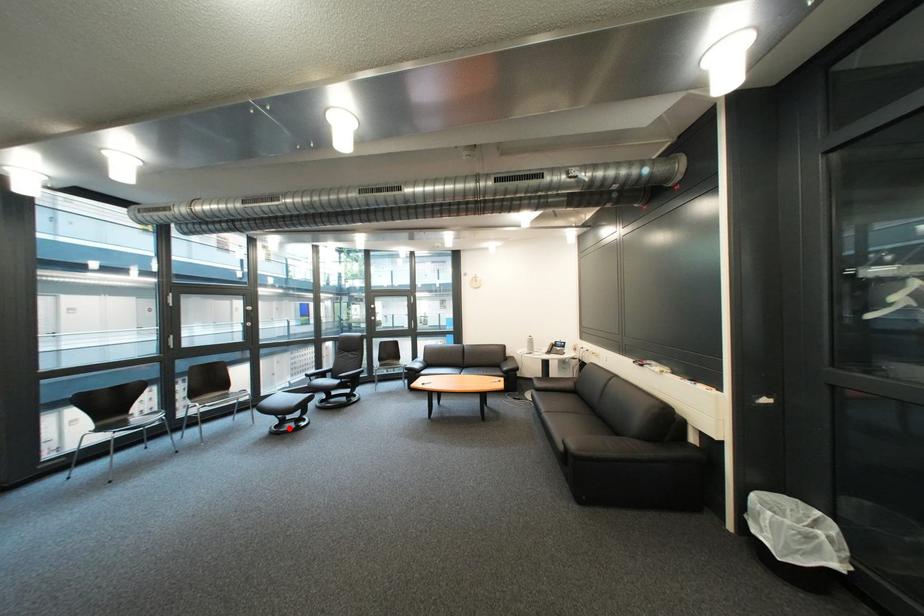
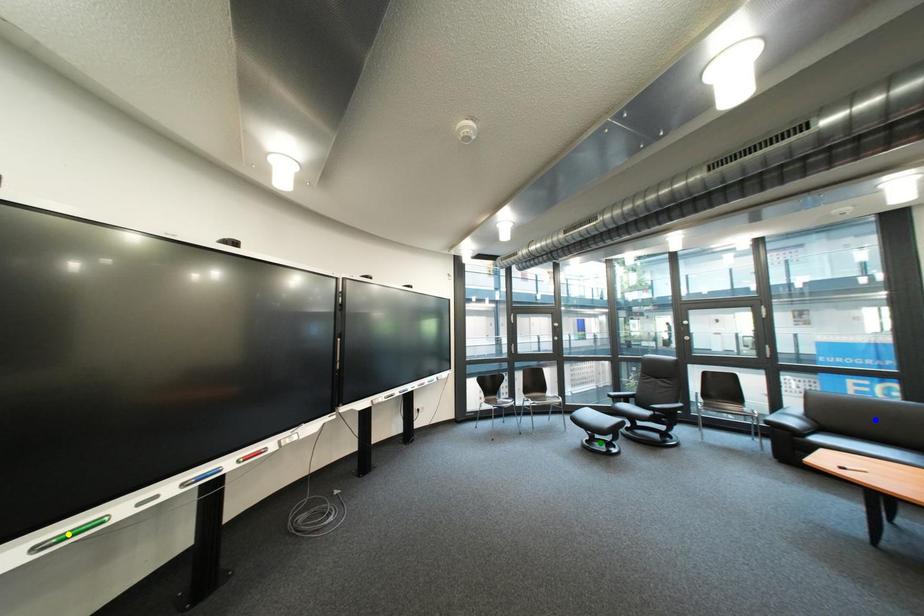
Question: I am providing you with two images of the same scene from different viewpoints. A red point is marked on the first image. You are given multiple points on the second image. Can you choose the point in image 2 that corresponds to the point in image 1?

Choices:
 (A) green point
 (B) yellow point
 (C) blue point

Answer: (A)